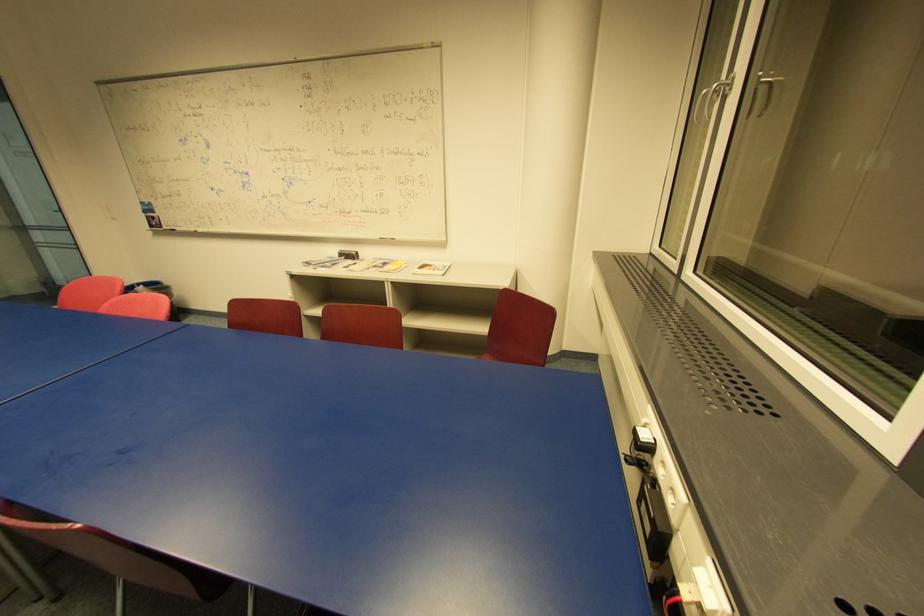
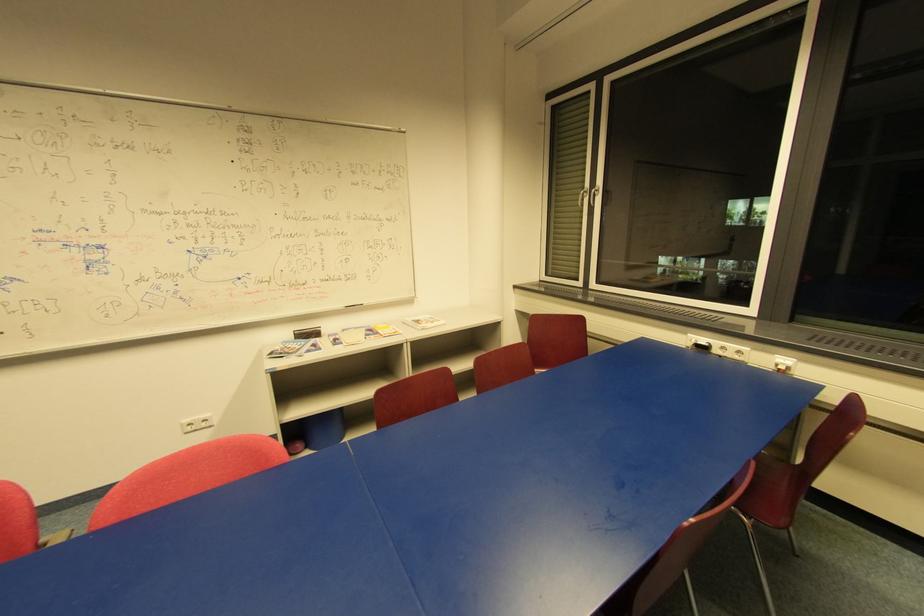
The point at (381, 238) is marked in the first image. Where is the corresponding point in the second image?

(344, 307)